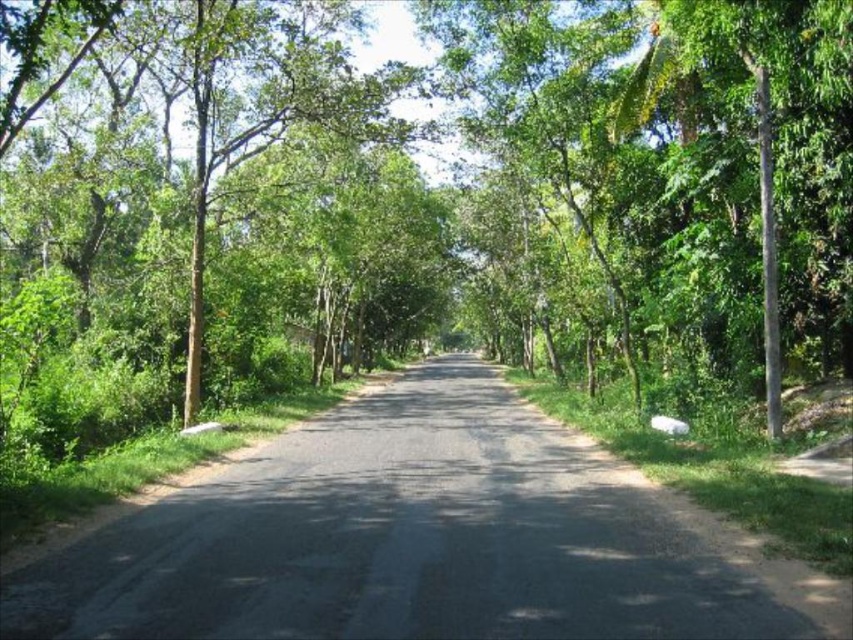
Question: Does green leafy tree at center have a lesser width compared to black asphalt road at center?

Choices:
 (A) no
 (B) yes

Answer: (A)

Question: Is green leafy tree at center positioned at the back of green leafy tree at left?

Choices:
 (A) yes
 (B) no

Answer: (A)

Question: Is green leafy tree at center positioned before black asphalt road at center?

Choices:
 (A) no
 (B) yes

Answer: (A)

Question: Which of the following is the farthest from the observer?

Choices:
 (A) green leafy tree at center
 (B) black asphalt road at center
 (C) green leafy tree at left

Answer: (A)

Question: Which of the following is the farthest from the observer?

Choices:
 (A) green leafy tree at center
 (B) black asphalt road at center

Answer: (A)

Question: Based on their relative distances, which object is farther from the green leafy tree at left?

Choices:
 (A) black asphalt road at center
 (B) green leafy tree at center

Answer: (A)